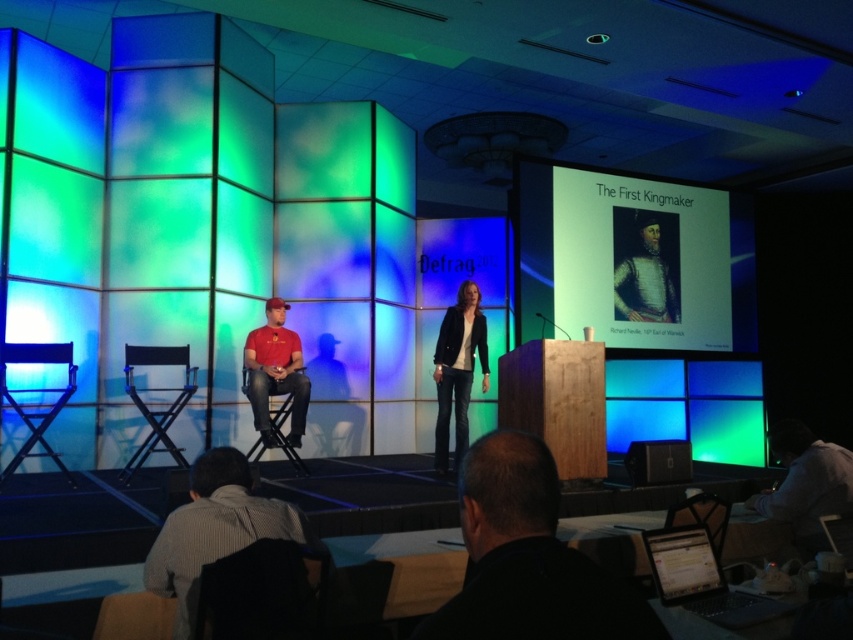
In the scene shown: You are an event coordinator who needs to adjust the seating arrangement for a live audience. There is a matte red shirt at left and a metallic blue chair at left on stage. Which object is positioned further back on the stage?

The metallic blue chair at left is positioned further back on the stage than the matte red shirt at left.

In the scene shown: You are an event photographer positioned at the back of the stage. You need to capture a clear shot of both the gray striped shirt at lower left and the matte black portrait at upper right. Which object will appear larger in your photo?

The gray striped shirt at lower left will appear larger in the photo because it is closer to the viewer than the matte black portrait at upper right.

You are an event coordinator checking the stage layout. You need to decide if the gray striped shirt at lower left can fit through a narrow doorway that the matte black portrait at upper right just barely fits through. Based on their widths, what would you conclude?

The gray striped shirt at lower left is thinner than the matte black portrait at upper right, which just fits through the doorway. Since the gray striped shirt at lower left is narrower, it should also fit through the doorway without any issues.